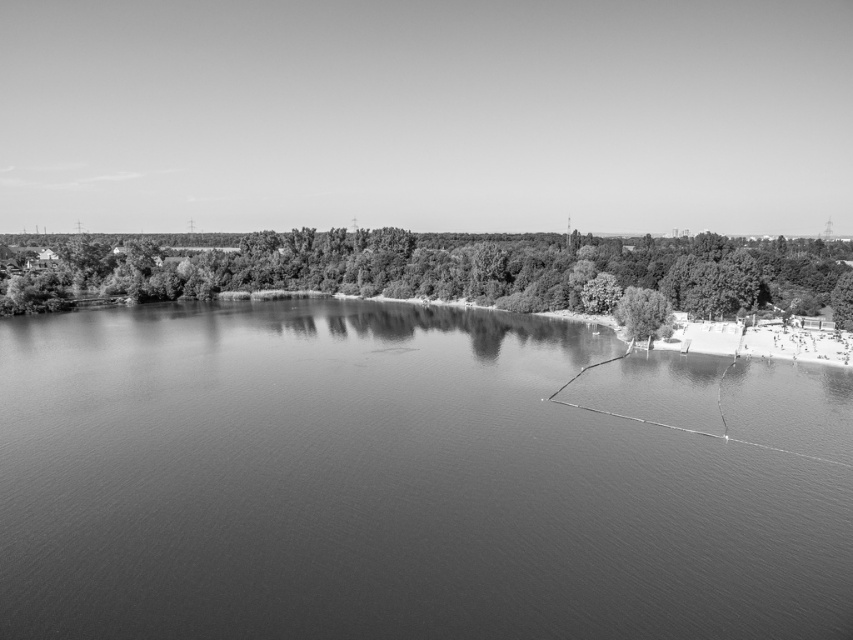
Between smooth water at lower right and green leafy tree at lower left, which one appears on the right side from the viewer's perspective?

Positioned to the right is smooth water at lower right.

Is point (247, 568) in front of point (364, 268)?

Yes, point (247, 568) is in front of point (364, 268).

Find the location of a particular element. The height and width of the screenshot is (640, 853). smooth water at lower right is located at coordinates (381, 486).

Which is behind, point (187, 417) or point (664, 321)?

Point (664, 321)

Between smooth water at lower right and green leafy tree at lower right, which one is positioned lower?

smooth water at lower right

Is point (560, 321) more distant than point (643, 308)?

Yes, point (560, 321) is farther from viewer.

At what (x,y) coordinates should I click in order to perform the action: click on smooth water at lower right. Please return your answer as a coordinate pair (x, y). This screenshot has height=640, width=853. Looking at the image, I should click on (381, 486).

Which of these two, green leafy tree at lower left or green leafy tree at lower right, stands taller?

green leafy tree at lower left is taller.

Is green leafy tree at lower left below green leafy tree at lower right?

No.

Is point (216, 269) behind point (647, 292)?

Yes.

Find the location of a particular element. The image size is (853, 640). green leafy tree at lower left is located at coordinates (474, 268).